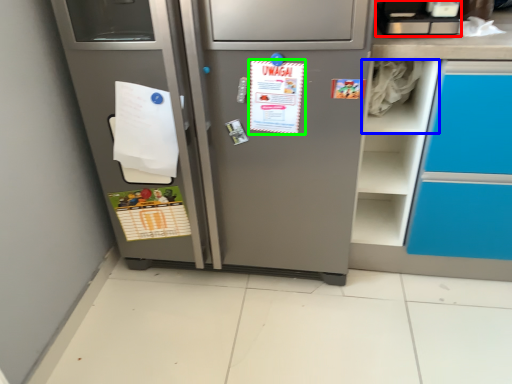
Question: Based on their relative distances, which object is nearer to appliance (highlighted by a red box)? Choose from shelf (highlighted by a blue box) and postcard (highlighted by a green box).

Choices:
 (A) shelf
 (B) postcard

Answer: (A)